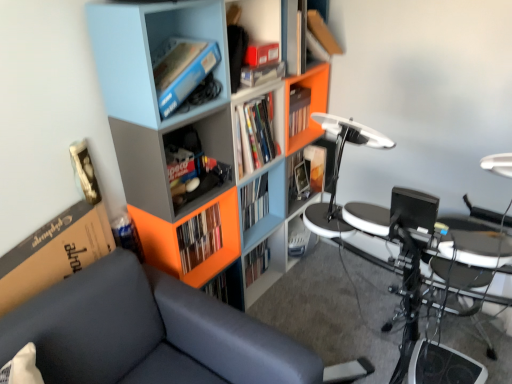
Locate an element on the screen. The image size is (512, 384). free space in front of matte plastic cabinet at center is located at coordinates (304, 274).